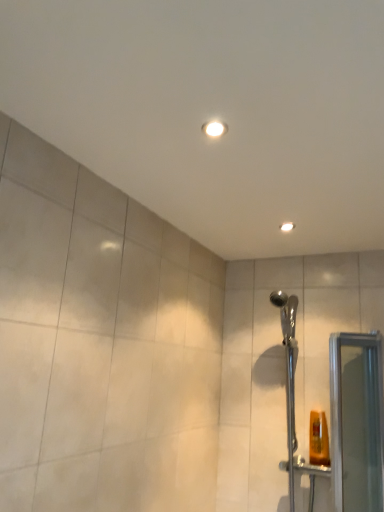
Question: From a real-world perspective, is matte white light fixture at upper center located higher than clear glass screen door at right?

Choices:
 (A) no
 (B) yes

Answer: (B)

Question: From the image's perspective, is matte white light fixture at upper center over clear glass screen door at right?

Choices:
 (A) no
 (B) yes

Answer: (B)

Question: Can you confirm if matte white light fixture at upper center is thinner than clear glass screen door at right?

Choices:
 (A) yes
 (B) no

Answer: (A)

Question: Is matte white light fixture at upper center positioned in front of clear glass screen door at right?

Choices:
 (A) yes
 (B) no

Answer: (B)

Question: Are matte white light fixture at upper center and clear glass screen door at right located far from each other?

Choices:
 (A) no
 (B) yes

Answer: (A)

Question: Is matte white light fixture at upper center positioned behind clear glass screen door at right?

Choices:
 (A) no
 (B) yes

Answer: (B)

Question: From a real-world perspective, is clear glass screen door at right positioned under matte white light fixture at upper center based on gravity?

Choices:
 (A) no
 (B) yes

Answer: (B)

Question: Considering the relative sizes of clear glass screen door at right and matte white light fixture at upper center in the image provided, is clear glass screen door at right shorter than matte white light fixture at upper center?

Choices:
 (A) no
 (B) yes

Answer: (A)

Question: Considering the relative positions of clear glass screen door at right and matte white light fixture at upper center in the image provided, is clear glass screen door at right to the right of matte white light fixture at upper center from the viewer's perspective?

Choices:
 (A) yes
 (B) no

Answer: (A)

Question: Is clear glass screen door at right positioned with its back to matte white light fixture at upper center?

Choices:
 (A) yes
 (B) no

Answer: (B)

Question: Is clear glass screen door at right located outside matte white light fixture at upper center?

Choices:
 (A) no
 (B) yes

Answer: (B)

Question: Are clear glass screen door at right and matte white light fixture at upper center located far from each other?

Choices:
 (A) no
 (B) yes

Answer: (A)

Question: Considering the relative sizes of chrome metallic shower head at right and clear glass screen door at right in the image provided, is chrome metallic shower head at right taller than clear glass screen door at right?

Choices:
 (A) yes
 (B) no

Answer: (A)